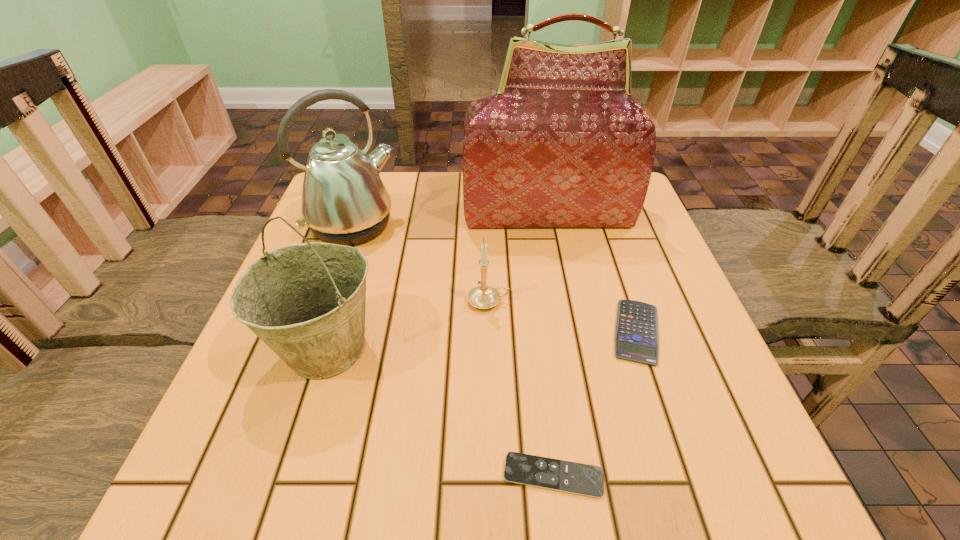
In order to click on object positioned at the far right corner in this screenshot , I will do [562, 143].

In the image, there is a desktop. Identify the location of vacant space at the far edge. This screenshot has width=960, height=540. (395, 177).

The height and width of the screenshot is (540, 960). I want to click on blank space at the near edge of the desktop, so click(598, 443).

The image size is (960, 540). What are the coordinates of `free spot at the left edge of the desktop` in the screenshot? It's located at (241, 369).

In the image, there is a desktop. At what (x,y) coordinates should I click in order to perform the action: click on vacant region at the right edge. Please return your answer as a coordinate pair (x, y). Looking at the image, I should click on (592, 237).

In the image, there is a desktop. Identify the location of free region at the far left corner. (384, 171).

Where is `vacant space at the near right corner`? vacant space at the near right corner is located at coordinates (677, 466).

Image resolution: width=960 pixels, height=540 pixels. I want to click on free area in between the calculator and the candle holder, so click(x=563, y=316).

Identify the location of free space between the remote control and the kettle. (453, 350).

The width and height of the screenshot is (960, 540). I want to click on unoccupied position between the handbag and the kettle, so click(450, 220).